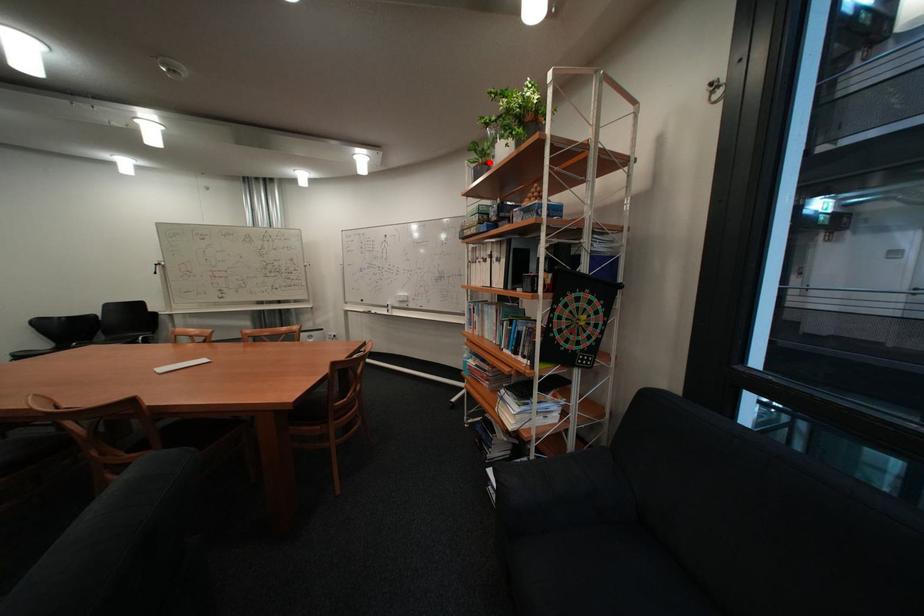
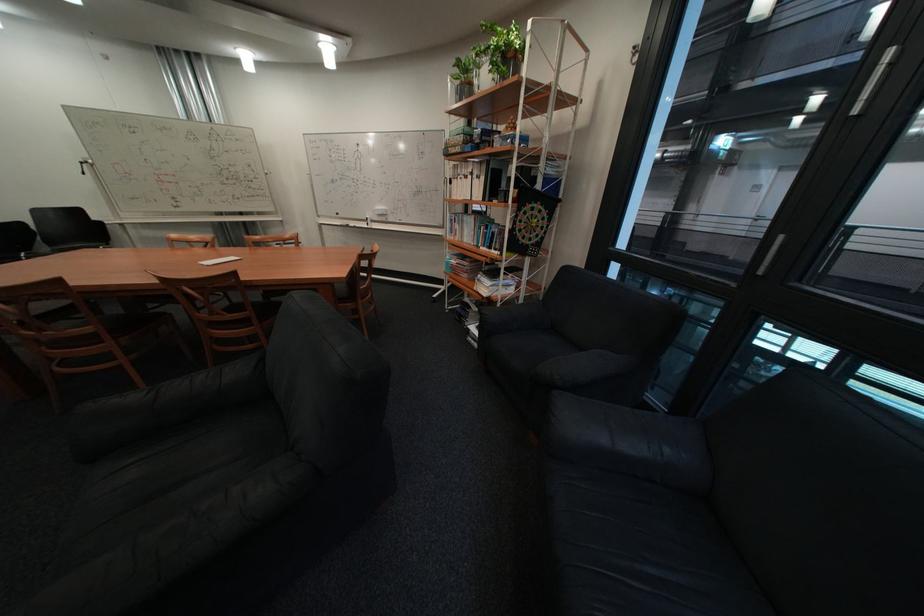
Locate, in the second image, the point that corresponds to the highlighted location in the first image.

(472, 79)